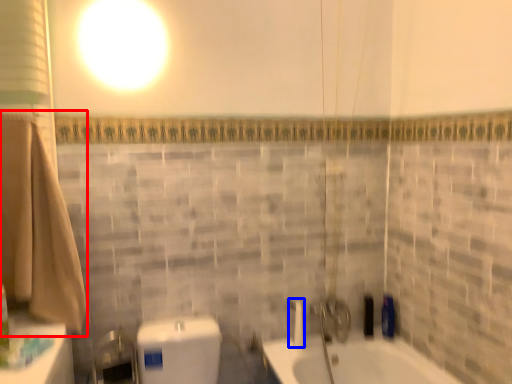
Question: Which object is closer to the camera taking this photo, bath towel (highlighted by a red box) or shower (highlighted by a blue box)?

Choices:
 (A) bath towel
 (B) shower

Answer: (A)